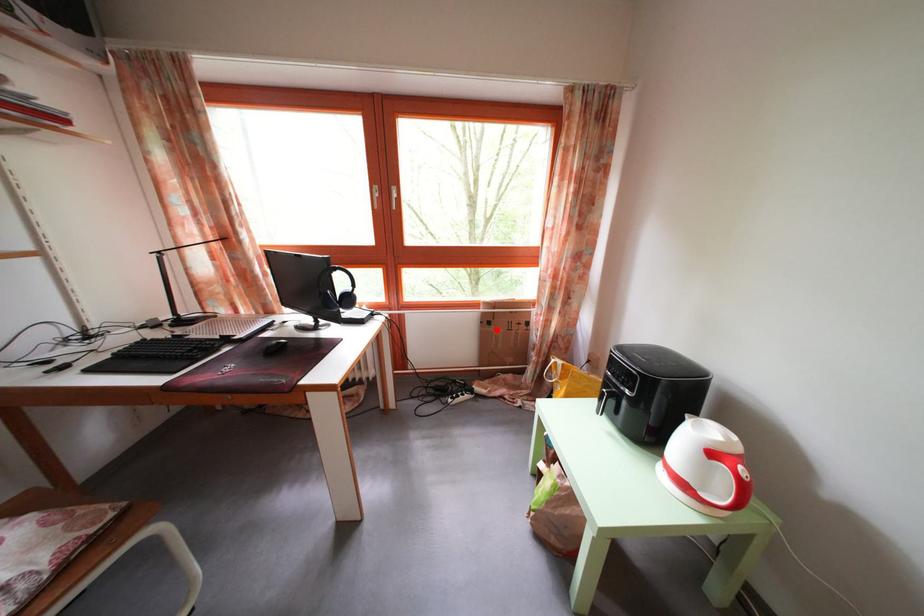
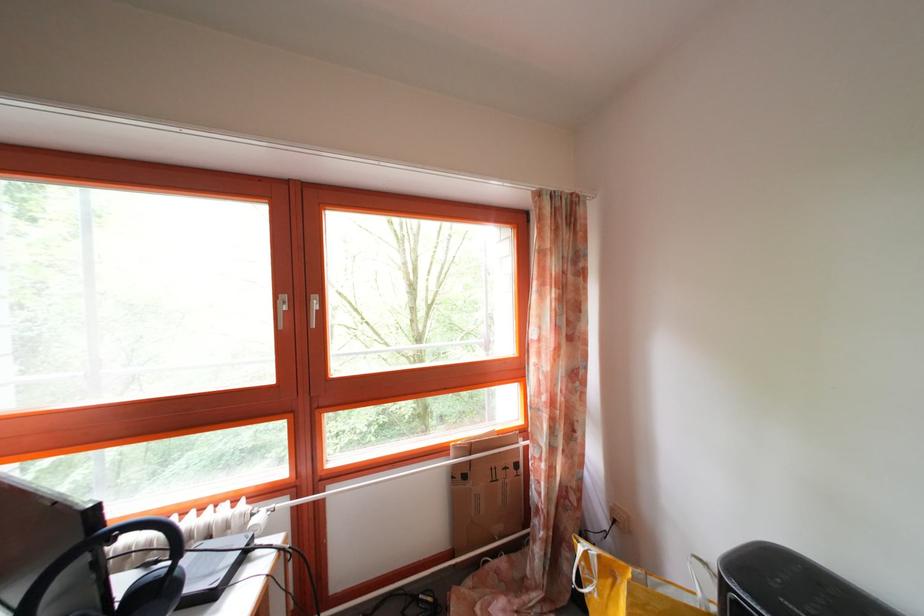
Question: I am providing you with two images of the same scene from different viewpoints. A red point is shown in image1. For the corresponding object point in image2, is it positioned nearer or farther from the camera?

Choices:
 (A) Nearer
 (B) Farther

Answer: (B)